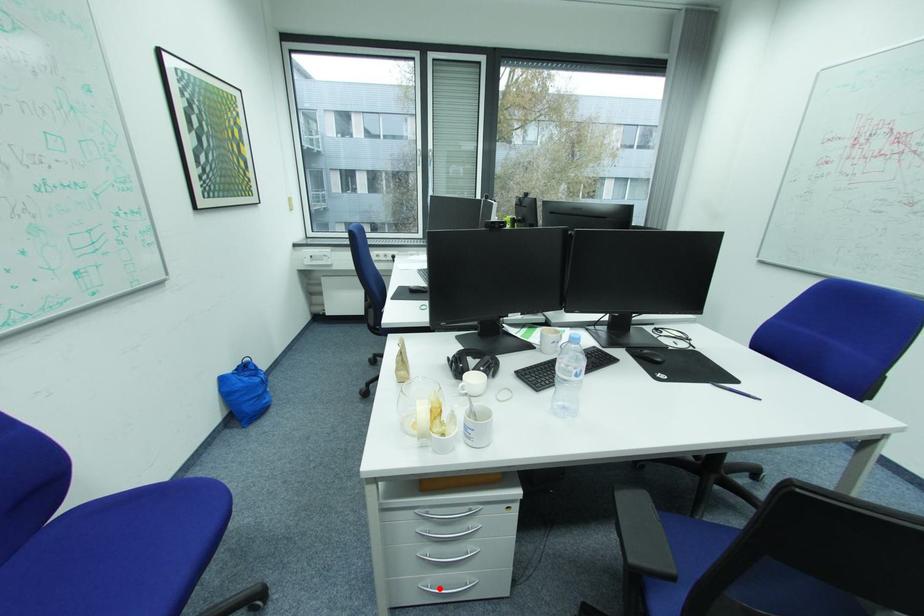
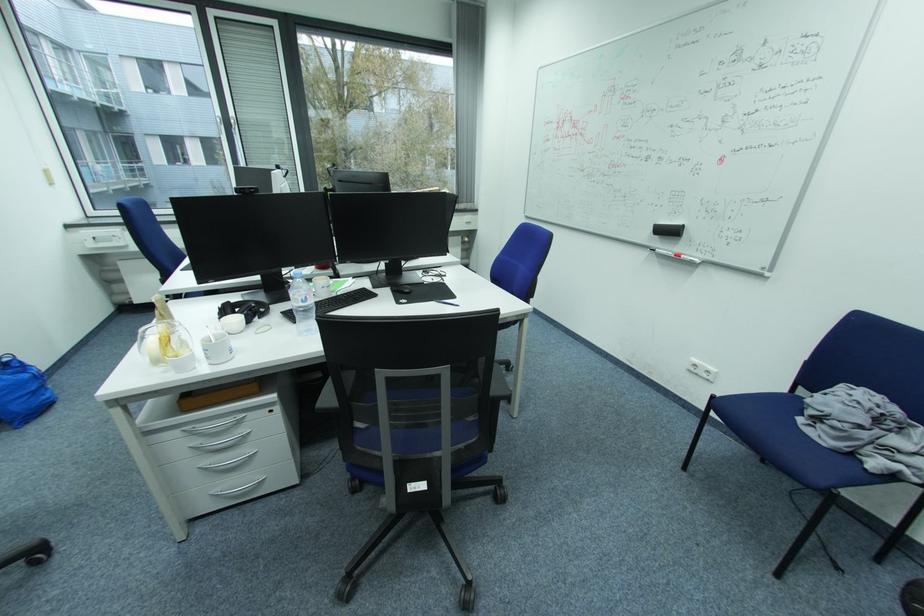
Question: I am providing you with two images of the same scene from different viewpoints. A red point is shown in image1. For the corresponding object point in image2, is it positioned nearer or farther from the camera?

Choices:
 (A) Nearer
 (B) Farther

Answer: (A)